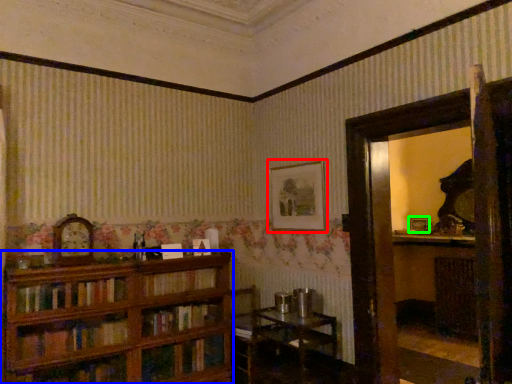
Question: Which object is the closest to the picture frame (highlighted by a red box)? Choose among these: bookcase (highlighted by a blue box) or picture frame (highlighted by a green box).

Choices:
 (A) bookcase
 (B) picture frame

Answer: (A)